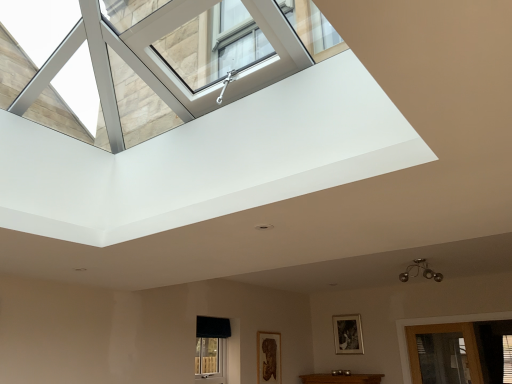
Question: From a real-world perspective, is wooden picture frame at center, the 1th picture frame positioned from the back, positioned over transparent glass door at lower right based on gravity?

Choices:
 (A) no
 (B) yes

Answer: (B)

Question: Considering the relative sizes of wooden picture frame at center, positioned as the second picture frame in front-to-back order, and transparent glass door at lower right in the image provided, is wooden picture frame at center, positioned as the second picture frame in front-to-back order, wider than transparent glass door at lower right?

Choices:
 (A) yes
 (B) no

Answer: (B)

Question: Are wooden picture frame at center, arranged as the second picture frame when viewed from the left, and transparent glass door at lower right beside each other?

Choices:
 (A) yes
 (B) no

Answer: (B)

Question: Considering the relative positions of wooden picture frame at center, the 1th picture frame positioned from the back, and transparent glass door at lower right in the image provided, is wooden picture frame at center, the 1th picture frame positioned from the back, to the right of transparent glass door at lower right from the viewer's perspective?

Choices:
 (A) yes
 (B) no

Answer: (B)

Question: Could you tell me if wooden picture frame at center, acting as the 1th picture frame starting from the right, is facing transparent glass door at lower right?

Choices:
 (A) no
 (B) yes

Answer: (A)

Question: Considering the positions of point (359, 321) and point (259, 344), is point (359, 321) closer or farther from the camera than point (259, 344)?

Choices:
 (A) closer
 (B) farther

Answer: (B)

Question: Considering the positions of wooden picture frame at center, arranged as the second picture frame when viewed from the left, and wooden carved frame at lower center, positioned as the 1th picture frame in front-to-back order, in the image, is wooden picture frame at center, arranged as the second picture frame when viewed from the left, bigger or smaller than wooden carved frame at lower center, positioned as the 1th picture frame in front-to-back order,?

Choices:
 (A) small
 (B) big

Answer: (A)

Question: Based on their positions, is wooden picture frame at center, acting as the 1th picture frame starting from the right, located to the left or right of wooden carved frame at lower center, marked as the first picture frame in a left-to-right arrangement?

Choices:
 (A) left
 (B) right

Answer: (B)

Question: Is wooden picture frame at center, arranged as the second picture frame when viewed from the left, taller or shorter than wooden carved frame at lower center, positioned as the second picture frame in right-to-left order?

Choices:
 (A) short
 (B) tall

Answer: (A)

Question: Is point (212, 332) positioned closer to the camera than point (347, 349)?

Choices:
 (A) farther
 (B) closer

Answer: (B)

Question: In the image, is black fabric window at lower center positioned in front of or behind wooden picture frame at center, acting as the 1th picture frame starting from the right?

Choices:
 (A) front
 (B) behind

Answer: (A)

Question: Considering the positions of black fabric window at lower center and wooden picture frame at center, positioned as the second picture frame in front-to-back order, in the image, is black fabric window at lower center wider or thinner than wooden picture frame at center, positioned as the second picture frame in front-to-back order,?

Choices:
 (A) thin
 (B) wide

Answer: (B)

Question: From the image's perspective, relative to wooden picture frame at center, the 1th picture frame positioned from the back, is black fabric window at lower center above or below?

Choices:
 (A) below
 (B) above

Answer: (B)

Question: Considering the relative positions of wooden picture frame at center, arranged as the second picture frame when viewed from the left, and transparent glass door at lower right in the image provided, is wooden picture frame at center, arranged as the second picture frame when viewed from the left, to the left or to the right of transparent glass door at lower right?

Choices:
 (A) right
 (B) left

Answer: (B)

Question: From the image's perspective, is wooden picture frame at center, arranged as the second picture frame when viewed from the left, located above or below transparent glass door at lower right?

Choices:
 (A) above
 (B) below

Answer: (A)